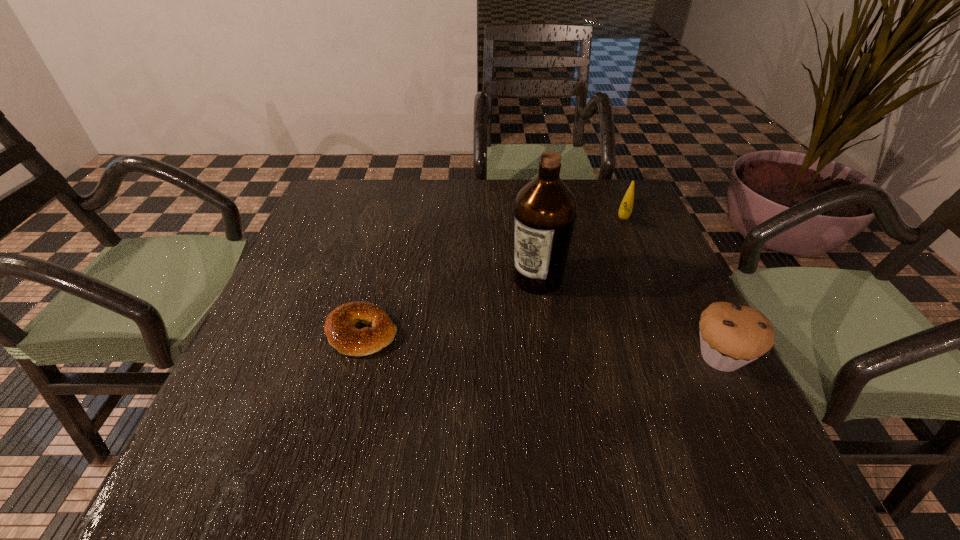
The height and width of the screenshot is (540, 960). In order to click on empty space between the second shortest object and the muffin in this screenshot , I will do 672,286.

The width and height of the screenshot is (960, 540). I want to click on free space between the leftmost object and the olive oil, so click(449, 305).

I want to click on free spot between the third shortest object and the farthest object, so click(x=672, y=286).

The image size is (960, 540). I want to click on vacant space in between the olive oil and the muffin, so click(629, 318).

Image resolution: width=960 pixels, height=540 pixels. I want to click on free space between the leftmost object and the third nearest object, so click(449, 305).

You are a GUI agent. You are given a task and a screenshot of the screen. Output one action in this format:
    pyautogui.click(x=<x>, y=<y>)
    Task: Click on the free space between the bagel and the muffin
    Image resolution: width=960 pixels, height=540 pixels.
    Given the screenshot: What is the action you would take?
    pyautogui.click(x=541, y=345)

This screenshot has width=960, height=540. Identify the location of empty space that is in between the muffin and the farthest object. (672, 286).

You are a GUI agent. You are given a task and a screenshot of the screen. Output one action in this format:
    pyautogui.click(x=<x>, y=<y>)
    Task: Click on the free space between the shortest object and the olive oil
    The height and width of the screenshot is (540, 960).
    Given the screenshot: What is the action you would take?
    pyautogui.click(x=449, y=305)

In order to click on free space between the shortest object and the second tallest object in this screenshot , I will do `click(541, 345)`.

The height and width of the screenshot is (540, 960). In order to click on object identified as the third closest to the shortest object in this screenshot , I will do `click(625, 210)`.